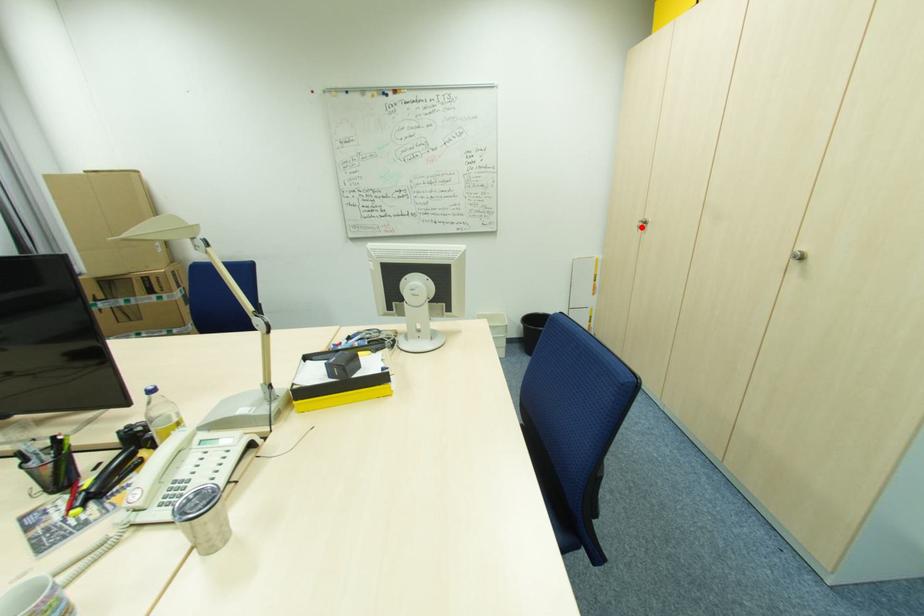
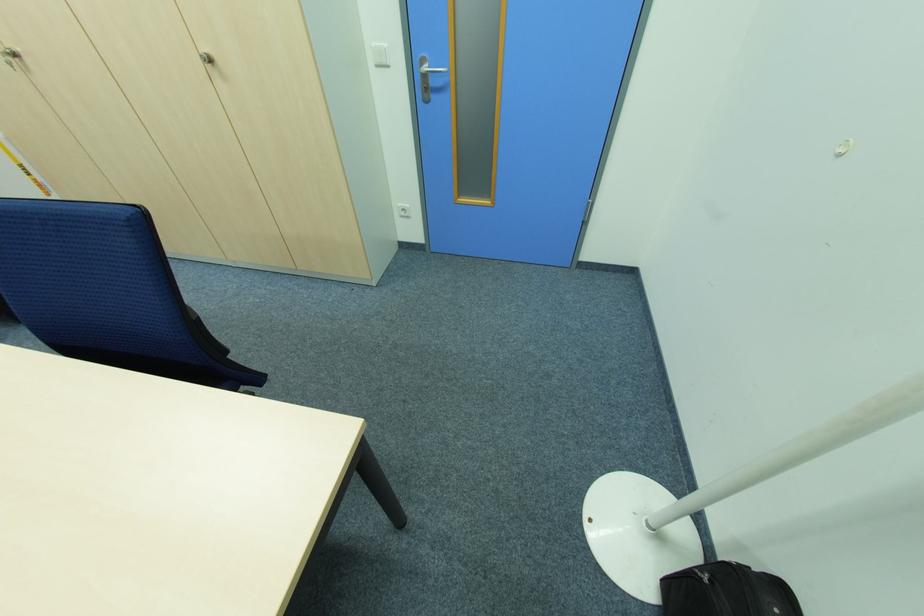
Locate, in the second image, the point that corresponds to the highlighted location in the first image.

(14, 65)